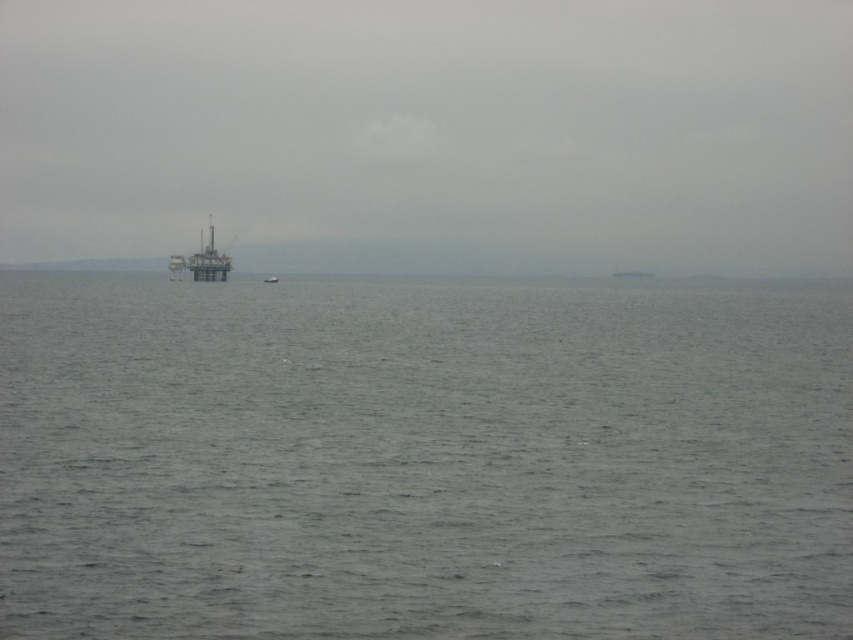
Does point (798, 337) come in front of point (209, 268)?

Yes, it is.

Can you confirm if gray matte water at center is taller than metallic gray platform at center?

No, gray matte water at center is not taller than metallic gray platform at center.

The image size is (853, 640). What are the coordinates of `gray matte water at center` in the screenshot? It's located at (422, 460).

Is gray matte boat at center wider than white plastic boat at center?

In fact, gray matte boat at center might be narrower than white plastic boat at center.

Which is in front, point (636, 275) or point (276, 280)?

Point (276, 280) is more forward.

Between point (618, 269) and point (277, 280), which one is positioned in front?

Point (277, 280) is more forward.

Locate an element on the screen. gray matte boat at center is located at coordinates (631, 273).

Can you confirm if gray matte water at center is taller than white plastic boat at center?

Yes, gray matte water at center is taller than white plastic boat at center.

Which is in front, point (529, 568) or point (265, 282)?

Point (529, 568)

I want to click on gray matte water at center, so click(422, 460).

This screenshot has width=853, height=640. In order to click on gray matte water at center in this screenshot , I will do `click(422, 460)`.